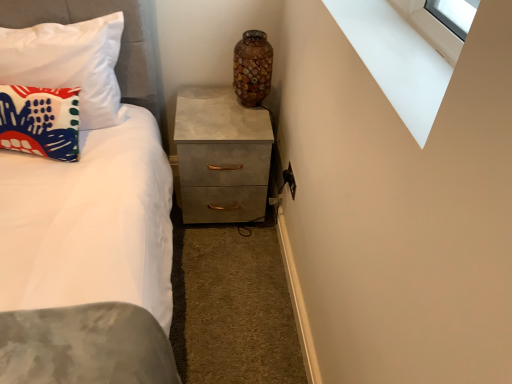
What are the coordinates of `vacant region above matte concrete chest of drawers at center (from a real-world perspective)` in the screenshot? It's located at (215, 109).